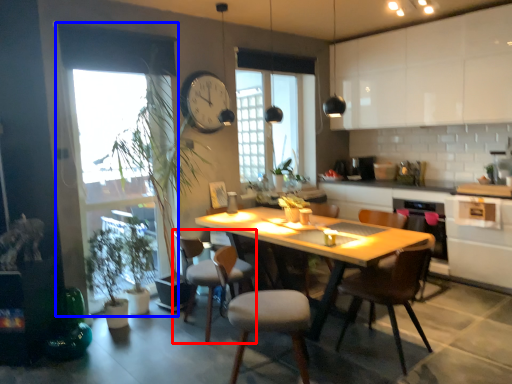
Question: Which point is closer to the camera, chair (highlighted by a red box) or window screen (highlighted by a blue box)?

Choices:
 (A) chair
 (B) window screen

Answer: (B)